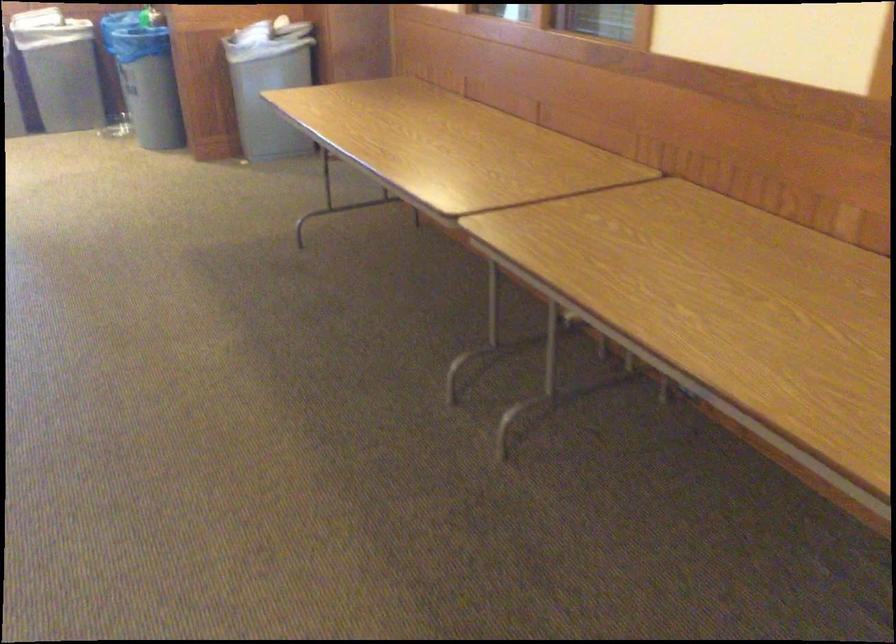
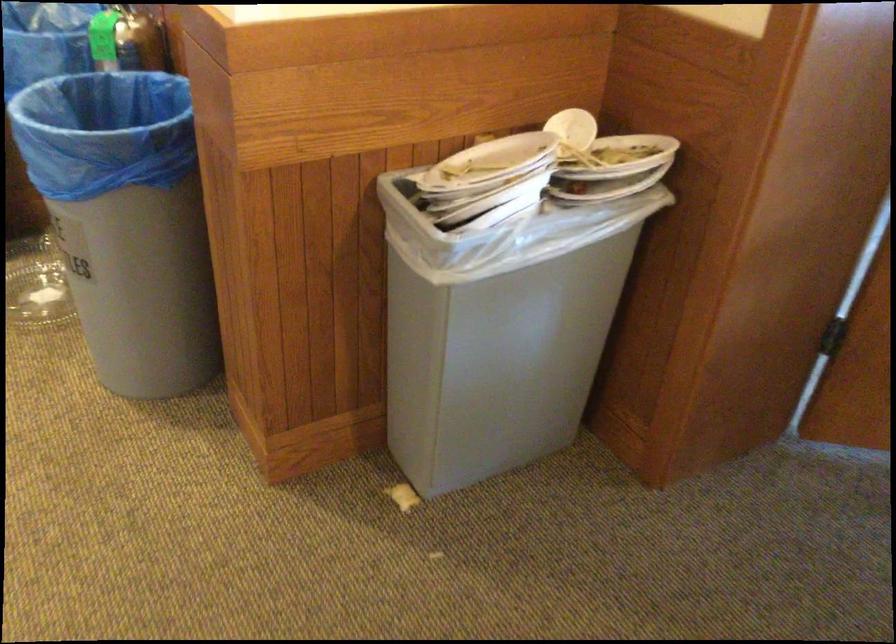
In a continuous first-person perspective shot, in which direction is the camera moving?

The cameraman walked toward left, forward.